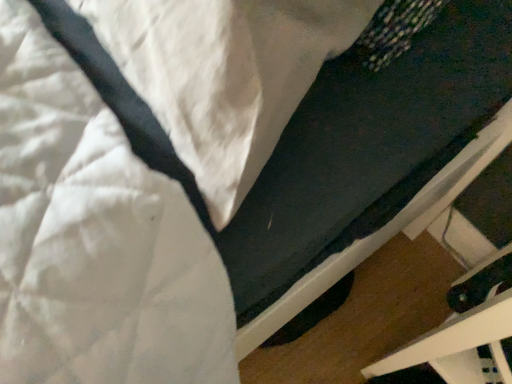
Find the location of a particular element. The image size is (512, 384). white plastic chair at lower right is located at coordinates (464, 333).

Describe the element at coordinates (464, 333) in the screenshot. This screenshot has width=512, height=384. I see `white plastic chair at lower right` at that location.

In order to face white plastic chair at lower right, should I rotate leftwards or rightwards?

Rotate your view right by about 33.163°.

Identify the location of white plastic chair at lower right. The width and height of the screenshot is (512, 384). point(464,333).